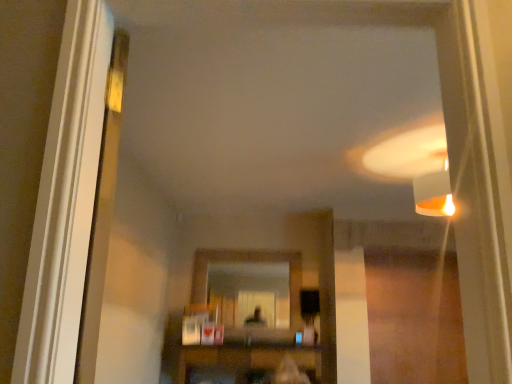
Question: From the image's perspective, does matte glass mirror at center appear higher than wooden shelf at center?

Choices:
 (A) no
 (B) yes

Answer: (B)

Question: Does matte glass mirror at center have a lesser height compared to wooden shelf at center?

Choices:
 (A) yes
 (B) no

Answer: (B)

Question: Is matte glass mirror at center behind wooden shelf at center?

Choices:
 (A) yes
 (B) no

Answer: (A)

Question: Is matte glass mirror at center to the right of wooden shelf at center from the viewer's perspective?

Choices:
 (A) yes
 (B) no

Answer: (B)

Question: Does matte glass mirror at center have a lesser width compared to wooden shelf at center?

Choices:
 (A) yes
 (B) no

Answer: (A)

Question: From a real-world perspective, is matte glass mirror at center on top of wooden shelf at center?

Choices:
 (A) no
 (B) yes

Answer: (B)

Question: Is wooden shelf at center touching matte glass mirror at center?

Choices:
 (A) yes
 (B) no

Answer: (B)

Question: Does wooden shelf at center appear on the right side of matte glass mirror at center?

Choices:
 (A) yes
 (B) no

Answer: (A)

Question: Does wooden shelf at center have a larger size compared to matte glass mirror at center?

Choices:
 (A) no
 (B) yes

Answer: (B)

Question: Is the position of wooden shelf at center more distant than that of matte glass mirror at center?

Choices:
 (A) yes
 (B) no

Answer: (B)

Question: From the image's perspective, is wooden shelf at center on top of matte glass mirror at center?

Choices:
 (A) yes
 (B) no

Answer: (B)

Question: Does wooden shelf at center turn towards matte glass mirror at center?

Choices:
 (A) yes
 (B) no

Answer: (B)

Question: Visually, is wooden shelf at center positioned to the left or to the right of matte glass mirror at center?

Choices:
 (A) right
 (B) left

Answer: (A)